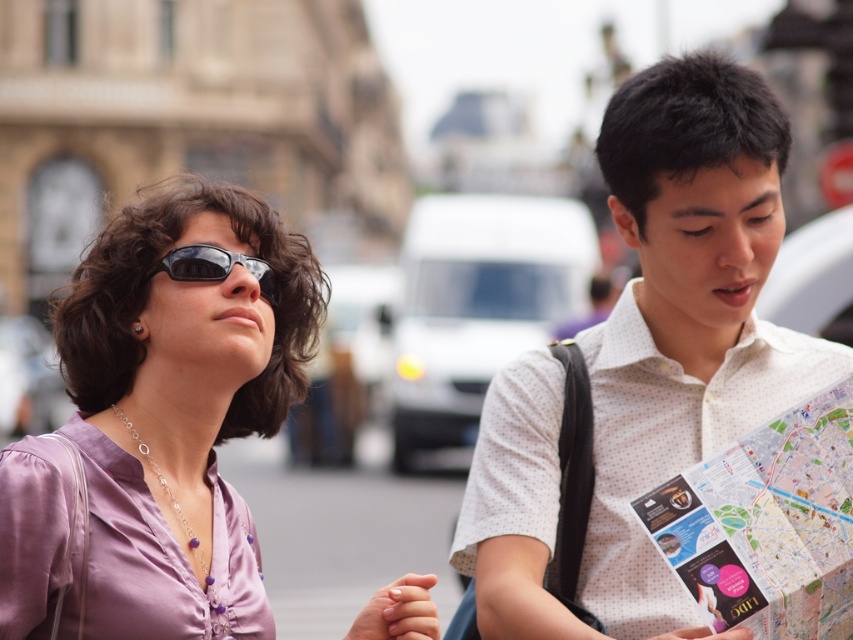
Is the position of paper map at center less distant than that of matte black sunglasses at upper left?

Yes, it is.

Between point (764, 566) and point (250, 259), which one is positioned behind?

The point (250, 259) is more distant.

Which is behind, point (825, 458) or point (166, 264)?

Positioned behind is point (166, 264).

Find the location of a particular element. paper map at center is located at coordinates (767, 524).

Does purple satin blouse at left have a greater height compared to matte black sunglasses at upper left?

Yes, purple satin blouse at left is taller than matte black sunglasses at upper left.

Locate an element on the screen. Image resolution: width=853 pixels, height=640 pixels. purple satin blouse at left is located at coordinates (180, 403).

Identify the location of purple satin blouse at left. (180, 403).

Does white dotted shirt at center come in front of purple satin blouse at left?

No, it is not.

Can you confirm if white dotted shirt at center is smaller than purple satin blouse at left?

Actually, white dotted shirt at center might be larger than purple satin blouse at left.

Find the location of a particular element. The width and height of the screenshot is (853, 640). white dotted shirt at center is located at coordinates (685, 314).

You are a GUI agent. You are given a task and a screenshot of the screen. Output one action in this format:
    pyautogui.click(x=<x>, y=<y>)
    Task: Click on the white dotted shirt at center
    The width and height of the screenshot is (853, 640).
    Given the screenshot: What is the action you would take?
    pyautogui.click(x=685, y=314)